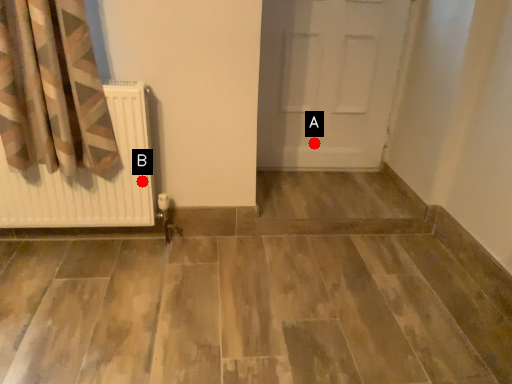
Question: Two points are circled on the image, labeled by A and B beside each circle. Which point is farther from the camera taking this photo?

Choices:
 (A) A is further
 (B) B is further

Answer: (A)